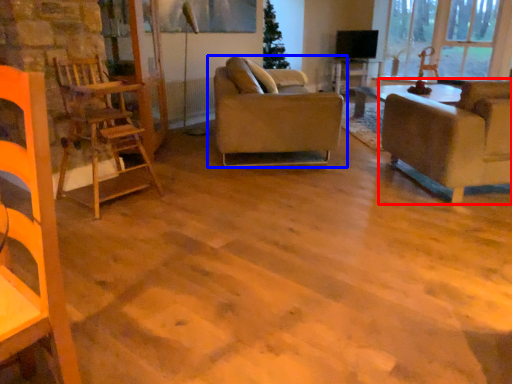
Question: Which object is further to the camera taking this photo, studio couch (highlighted by a red box) or studio couch (highlighted by a blue box)?

Choices:
 (A) studio couch
 (B) studio couch

Answer: (B)